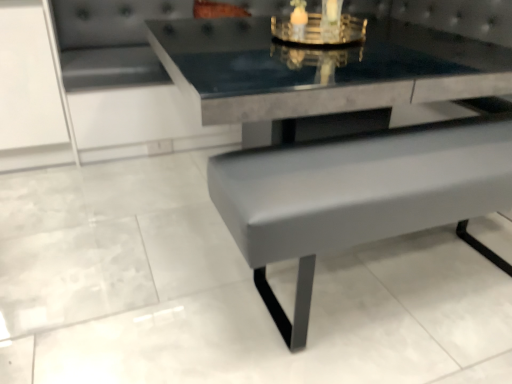
Question: Should I look upward or downward to see matte gray bench at lower right?

Choices:
 (A) down
 (B) up

Answer: (B)

Question: From a real-world perspective, is gold metallic candle holder at upper center on matte gray bench at lower right?

Choices:
 (A) no
 (B) yes

Answer: (B)

Question: Does gold metallic candle holder at upper center have a greater width compared to matte gray bench at lower right?

Choices:
 (A) no
 (B) yes

Answer: (A)

Question: Does gold metallic candle holder at upper center appear on the right side of matte gray bench at lower right?

Choices:
 (A) no
 (B) yes

Answer: (A)

Question: Is gold metallic candle holder at upper center touching matte gray bench at lower right?

Choices:
 (A) no
 (B) yes

Answer: (A)

Question: Can you confirm if gold metallic candle holder at upper center is smaller than matte gray bench at lower right?

Choices:
 (A) no
 (B) yes

Answer: (B)

Question: Can you confirm if gold metallic candle holder at upper center is taller than matte gray bench at lower right?

Choices:
 (A) yes
 (B) no

Answer: (B)

Question: From a real-world perspective, is matte gray bench at lower right under gold metallic candle holder at upper center?

Choices:
 (A) yes
 (B) no

Answer: (A)

Question: Is matte gray bench at lower right surrounding gold metallic candle holder at upper center?

Choices:
 (A) no
 (B) yes

Answer: (A)

Question: From a real-world perspective, is matte gray bench at lower right on top of gold metallic candle holder at upper center?

Choices:
 (A) yes
 (B) no

Answer: (B)

Question: Can you confirm if matte gray bench at lower right is bigger than gold metallic candle holder at upper center?

Choices:
 (A) yes
 (B) no

Answer: (A)

Question: Is matte gray bench at lower right aimed at gold metallic candle holder at upper center?

Choices:
 (A) yes
 (B) no

Answer: (B)

Question: Can you confirm if matte gray bench at lower right is wider than gold metallic candle holder at upper center?

Choices:
 (A) yes
 (B) no

Answer: (A)

Question: Considering the positions of point (274, 23) and point (429, 205), is point (274, 23) closer or farther from the camera than point (429, 205)?

Choices:
 (A) closer
 (B) farther

Answer: (B)